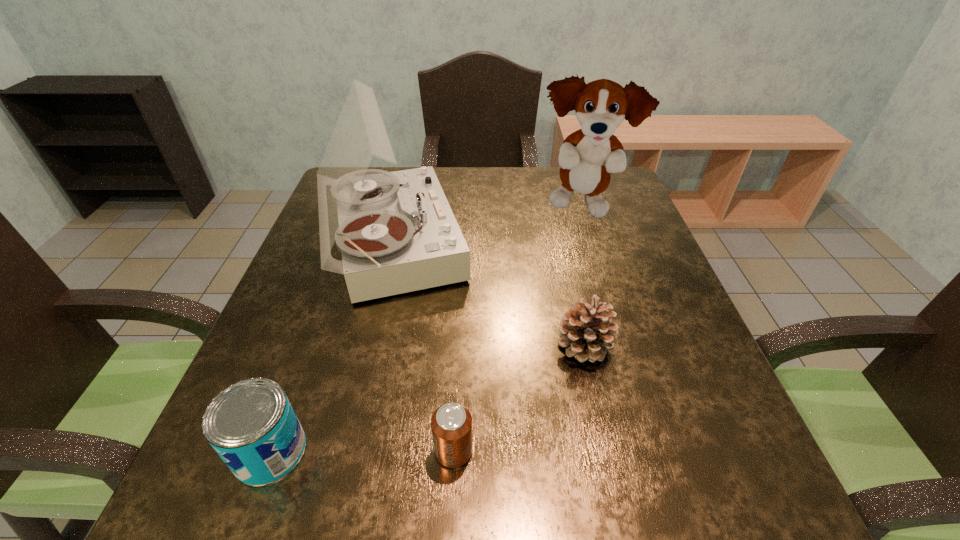
Find the location of a particular element. puppy is located at coordinates (587, 156).

Identify the location of record player. (396, 231).

You are a GUI agent. You are given a task and a screenshot of the screen. Output one action in this format:
    pyautogui.click(x=<x>, y=<y>)
    Task: Click on the pinecone
    The height and width of the screenshot is (540, 960).
    Given the screenshot: What is the action you would take?
    pyautogui.click(x=585, y=332)

Identify the location of the left can. click(x=252, y=426).

Find the location of `the shortest object`. the shortest object is located at coordinates (451, 424).

Locate an element on the screen. the right can is located at coordinates (451, 424).

The image size is (960, 540). Identify the location of vacant space located on the face of the puppy. (595, 256).

In order to click on free space located 0.160m on the back of the record player in this screenshot , I will do `click(410, 168)`.

Identify the location of vacant space located 0.220m on the front of the pinecone. (617, 492).

The width and height of the screenshot is (960, 540). Find the location of `vacant space located on the right of the left can`. vacant space located on the right of the left can is located at coordinates (551, 451).